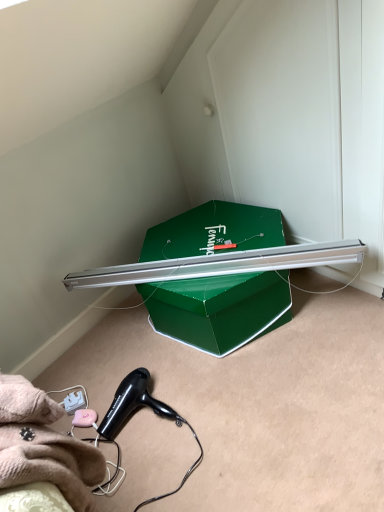
This screenshot has width=384, height=512. I want to click on spots to the right of black plastic hair dryer at lower left, so click(223, 398).